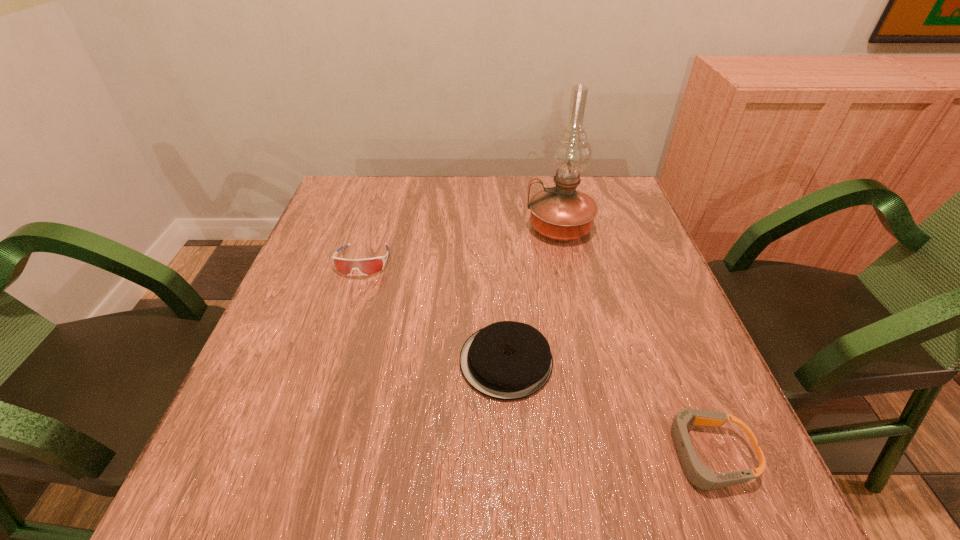
The height and width of the screenshot is (540, 960). In order to click on vacant space located on the front and back of the nearest object in this screenshot , I will do `click(532, 454)`.

At what (x,y) coordinates should I click in order to perform the action: click on vacant space located 0.240m on the front and back of the nearest object. Please return your answer as a coordinate pair (x, y). The image size is (960, 540). Looking at the image, I should click on (514, 454).

You are a GUI agent. You are given a task and a screenshot of the screen. Output one action in this format:
    pyautogui.click(x=<x>, y=<y>)
    Task: Click on the object that is positioned at the far edge
    The image size is (960, 540).
    Given the screenshot: What is the action you would take?
    pyautogui.click(x=561, y=213)

Locate an element on the screen. This screenshot has width=960, height=540. object located in the near edge section of the desktop is located at coordinates (698, 474).

Find the location of `object at the left edge`. object at the left edge is located at coordinates (368, 266).

Where is `oil lamp that is at the right edge`? Image resolution: width=960 pixels, height=540 pixels. oil lamp that is at the right edge is located at coordinates (561, 213).

Where is `goggles positioned at the right edge`? The height and width of the screenshot is (540, 960). goggles positioned at the right edge is located at coordinates (698, 474).

Locate an element on the screen. object that is positioned at the far right corner is located at coordinates (561, 213).

Where is `object located in the near right corner section of the desktop`? object located in the near right corner section of the desktop is located at coordinates (698, 474).

This screenshot has width=960, height=540. What are the coordinates of `free space at the far edge of the desktop` in the screenshot? It's located at (439, 208).